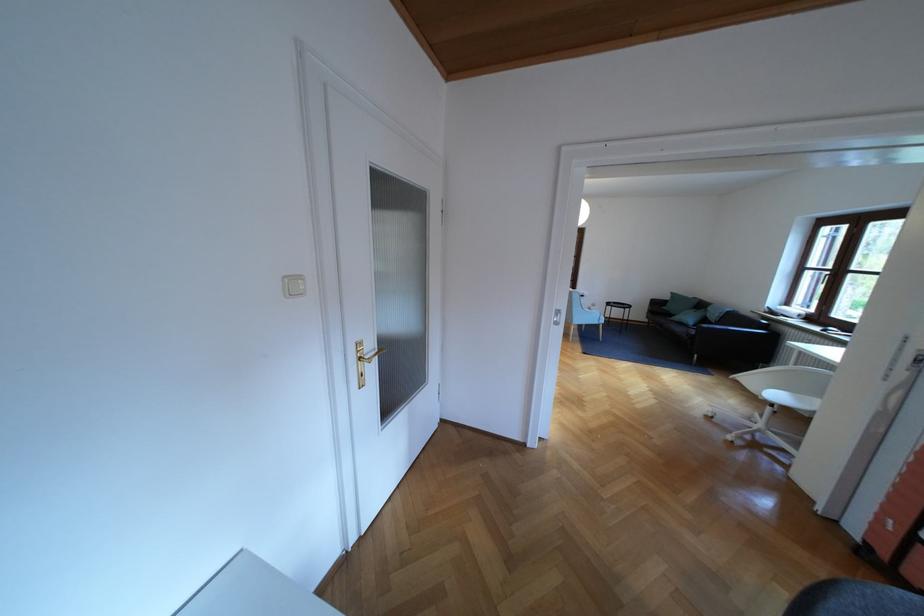
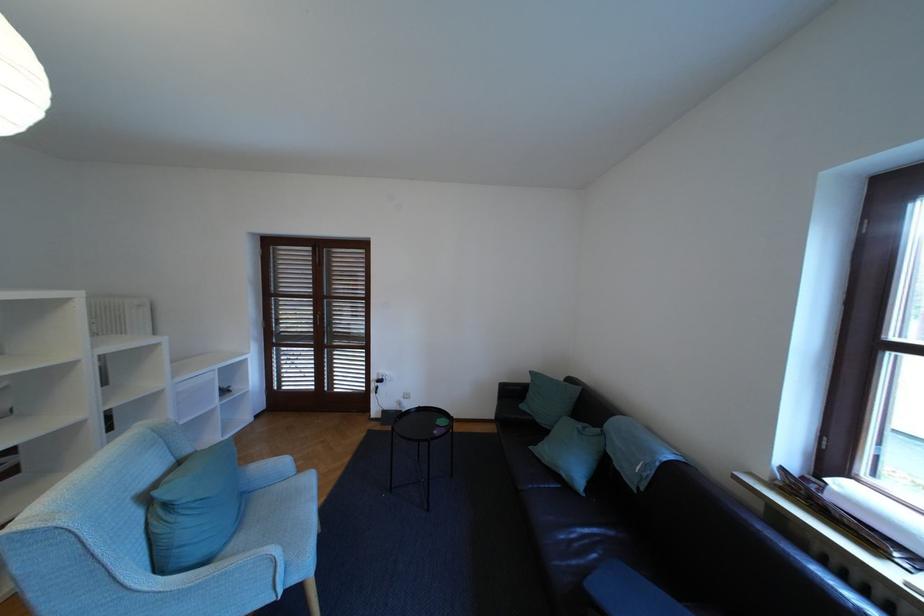
Where in the second image is the point corresponding to point 677,297 from the first image?

(536, 379)